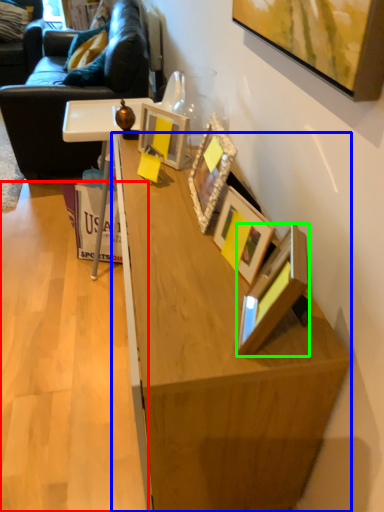
Question: Which is nearer to the plywood (highlighted by a red box)? desk (highlighted by a blue box) or picture frame (highlighted by a green box).

Choices:
 (A) desk
 (B) picture frame

Answer: (A)